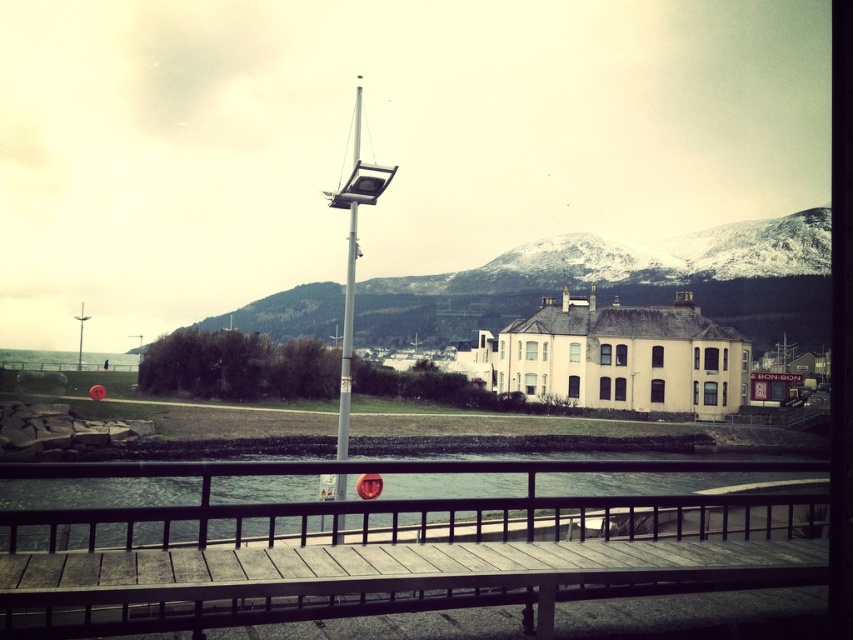
Question: Based on their relative distances, which object is farther from the transparent glass water at lower center?

Choices:
 (A) silver metallic pole at center
 (B) snowy rock formation at center

Answer: (B)

Question: Does wooden dock at center appear over silver metallic pole at center?

Choices:
 (A) no
 (B) yes

Answer: (A)

Question: Which of the following is the closest to the observer?

Choices:
 (A) (440, 529)
 (B) (370, 532)
 (C) (357, 161)

Answer: (B)

Question: Where is wooden dock at center located in relation to silver metallic pole at center in the image?

Choices:
 (A) right
 (B) left

Answer: (A)

Question: Which of the following is the farthest from the observer?

Choices:
 (A) snowy rock formation at center
 (B) transparent glass water at lower center
 (C) wooden dock at center

Answer: (A)

Question: Can you confirm if snowy rock formation at center is smaller than silver metallic pole at center?

Choices:
 (A) yes
 (B) no

Answer: (B)